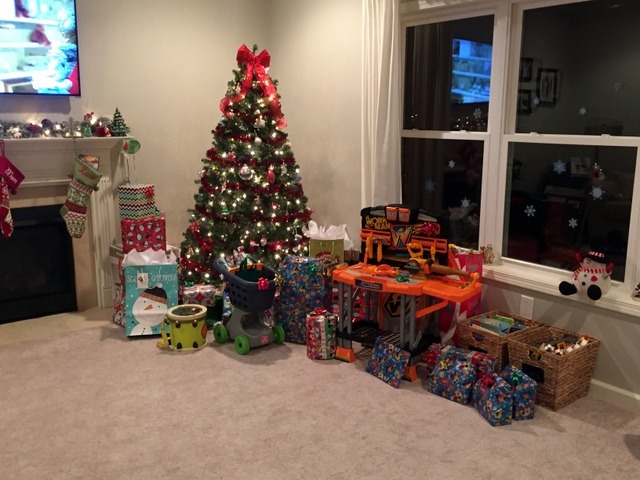
This screenshot has height=480, width=640. I want to click on curtains, so click(x=374, y=72).